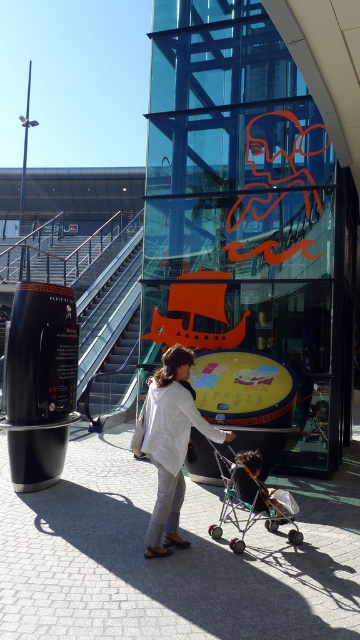
Question: Can you confirm if metallic silver escalator at center is thinner than white matte lab coat at center?

Choices:
 (A) yes
 (B) no

Answer: (B)

Question: Estimate the real-world distances between objects in this image. Which object is farther from the metallic silver stroller at center?

Choices:
 (A) dark brown leather stroller at lower center
 (B) metallic silver escalator at center

Answer: (B)

Question: Observing the image, what is the correct spatial positioning of metallic silver stroller at center in reference to white matte lab coat at center?

Choices:
 (A) right
 (B) left

Answer: (A)

Question: Which of the following is the closest to the observer?

Choices:
 (A) (213, 538)
 (B) (288, 513)

Answer: (A)

Question: Is white matte jacket at center above white matte lab coat at center?

Choices:
 (A) no
 (B) yes

Answer: (A)

Question: Which of these objects is positioned closest to the metallic silver stroller at center?

Choices:
 (A) white matte jacket at center
 (B) metallic silver escalator at center

Answer: (A)